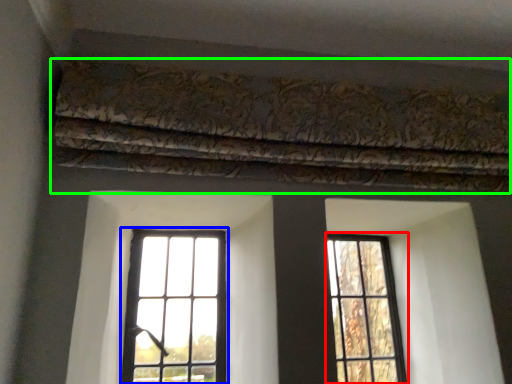
Question: Which object is the farthest from window (highlighted by a red box)? Choose among these: window (highlighted by a blue box) or curtain (highlighted by a green box).

Choices:
 (A) window
 (B) curtain

Answer: (B)